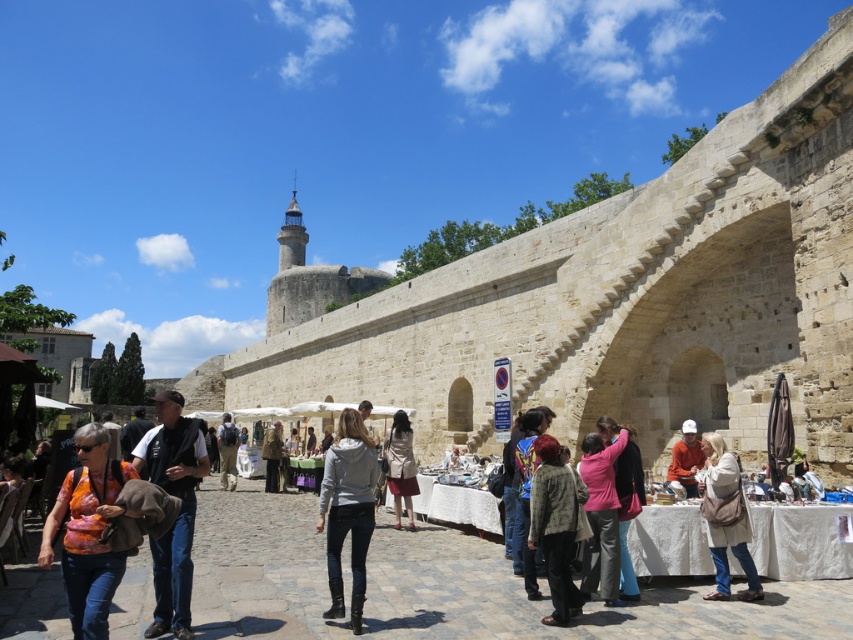
From the picture: You are a vendor at the market and need to decide which item to display first. The printed cotton shirt at lower left and the gray matte hoodie at center are both on your stall. Which item has a greater width?

The printed cotton shirt at lower left has a greater width than the gray matte hoodie at center.

You are standing at the entrance of the market and see the pink fabric jacket at center. If you walk straight ahead, will you pass by the jacket first before reaching the historic stone wall on the right?

The pink fabric jacket at center is located at coordinates (x=601, y=515). Since the historic stone wall is on the right side of the frame, walking straight ahead would first encounter the jacket before reaching the wall.